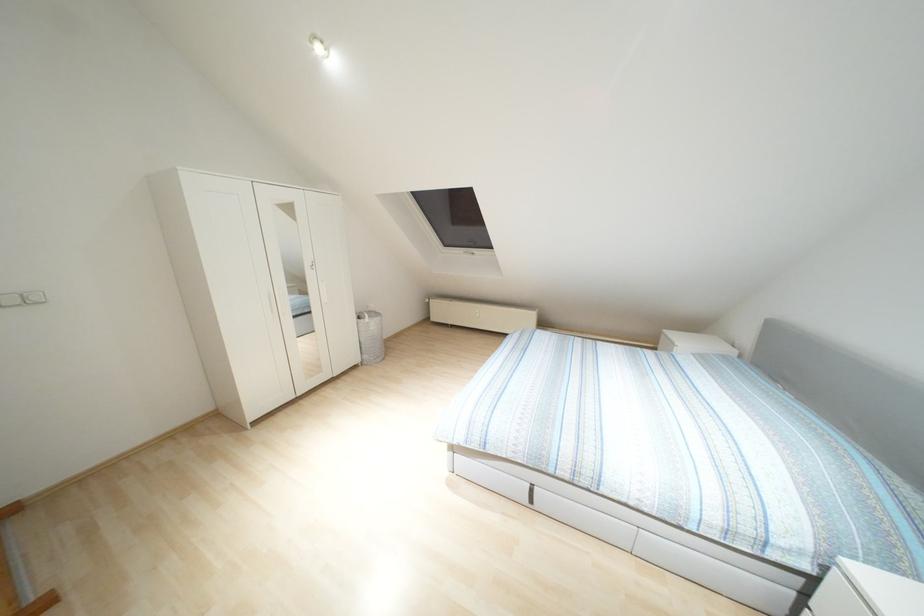
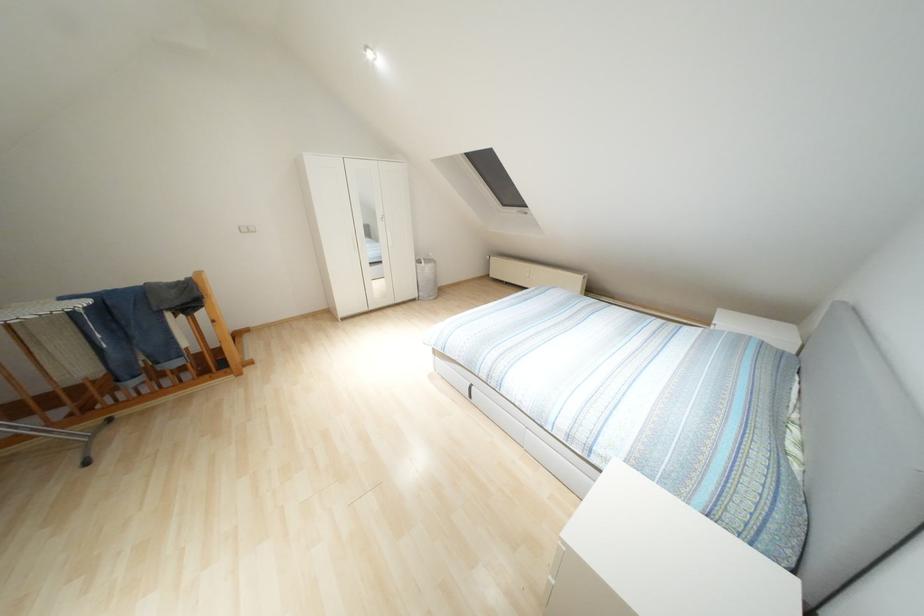
The point at (333, 299) is marked in the first image. Where is the corresponding point in the second image?

(396, 245)